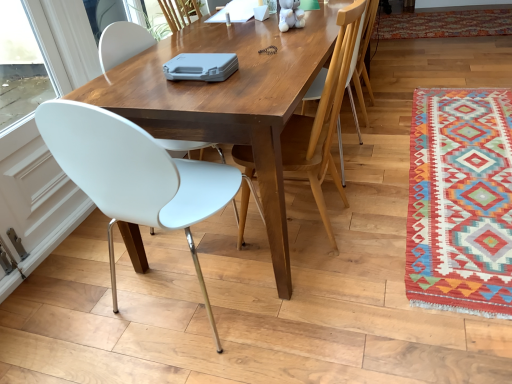
In order to click on empty space that is in between white plastic chair at left, the first chair when ordered from left to right, and wooden table at center in this screenshot , I will do `click(213, 312)`.